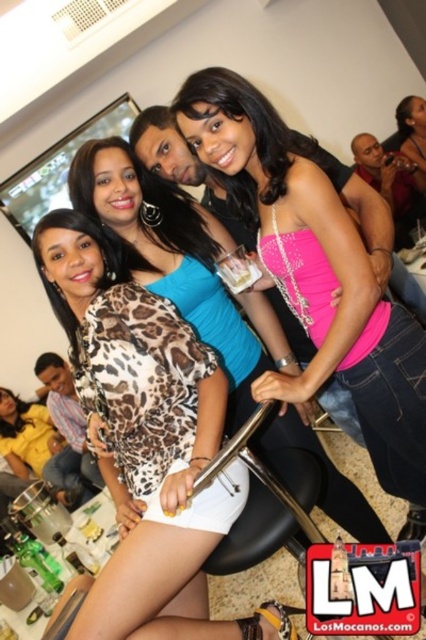
You are at a party and want to find the white matte dress at center. According to the coordinates provided, where exactly is it located in the image?

The white matte dress at center is located at point coordinates of (212,316).

You are a photographer at the event and want to focus on the leopard print blouse at center and the clear plastic cup at center. Which object should you adjust your camera focus to first to ensure both are in focus?

The leopard print blouse at center is closer to the viewer than the clear plastic cup at center, so you should focus on the leopard print blouse at center first. This will ensure the clear plastic cup at center remains in focus as well.

You are a photographer at the event and want to ensure the white matte dress at center and the pink satin dress at center are both visible in the photo. Based on their positions, which dress should you focus on first to capture both effectively?

The white matte dress at center is located below the pink satin dress at center, so focusing on the pink satin dress at center first will ensure both dresses are in frame as the white matte dress at center will naturally be captured below it.